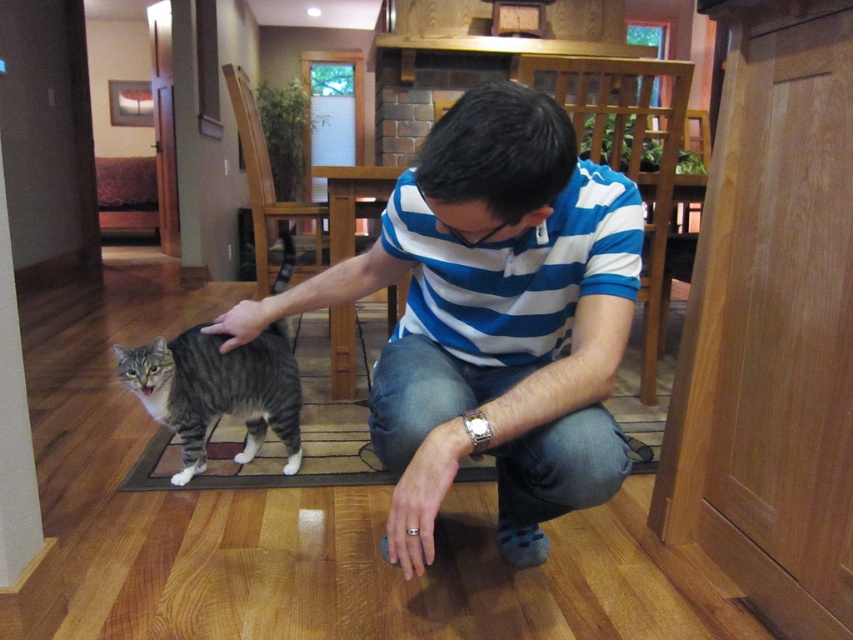
What is located at the coordinate point (492, 320) in the image?

The blue striped shirt at center is located at the coordinate point (492, 320).

You are a photographer trying to capture a candid shot of the man and the cat. The camera you are using has a focus range that can only accommodate objects within a 1.5 meter height difference. Given that the blue striped shirt at center is taller than the striped fur cat at center, will you be able to focus on both subjects simultaneously?

The blue striped shirt at center is taller than the striped fur cat at center. Since the height difference between them is within the camera focus range of 1.5 meters, you can focus on both subjects simultaneously.

You are designing a new outfit for the man in the scene and need to ensure it fits properly. Given that the blue striped shirt at center is wider than the striped fur cat at center, which object should you measure to determine the correct size for the new outfit?

You should measure the blue striped shirt at center since its width is greater than the striped fur cat at center, indicating it is the appropriate reference for the man.